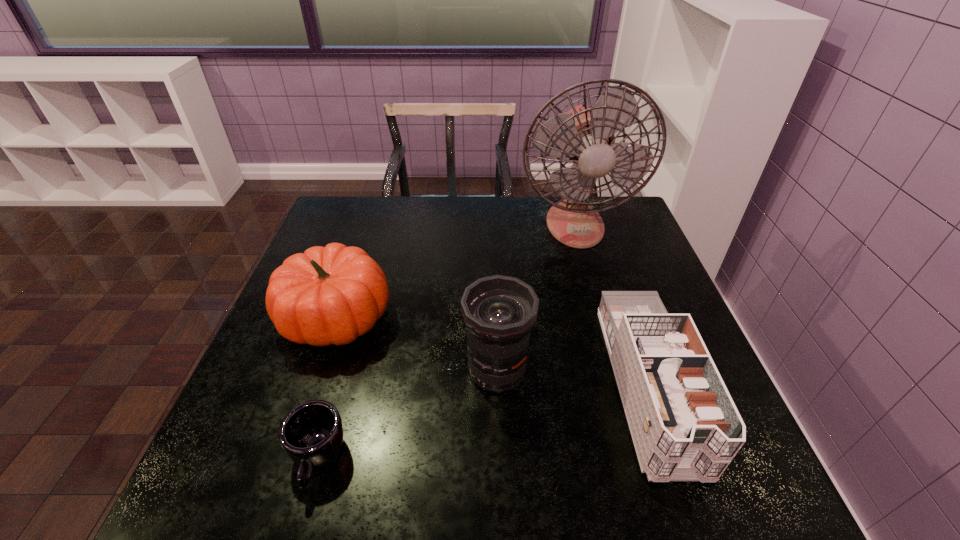
Identify the location of vacant space at the near edge of the desktop. (622, 469).

Locate an element on the screen. free region at the left edge of the desktop is located at coordinates (260, 395).

This screenshot has height=540, width=960. In order to click on free region at the right edge of the desktop in this screenshot , I will do `click(750, 457)`.

Where is `vacant space at the near left corner`? The height and width of the screenshot is (540, 960). vacant space at the near left corner is located at coordinates (222, 503).

Identify the location of vacant space at the far right corner. (611, 203).

Locate an element on the screen. This screenshot has height=540, width=960. free space between the fan and the shortest object is located at coordinates (446, 342).

This screenshot has width=960, height=540. What are the coordinates of `empty space between the shortest object and the second shortest object` in the screenshot? It's located at (482, 422).

You are a GUI agent. You are given a task and a screenshot of the screen. Output one action in this format:
    pyautogui.click(x=<x>, y=<y>)
    Task: Click on the free space that is in between the mug and the fan
    The width and height of the screenshot is (960, 540).
    Given the screenshot: What is the action you would take?
    pyautogui.click(x=446, y=342)

Find the location of `empty location between the telephoto lens and the second shortest object`. empty location between the telephoto lens and the second shortest object is located at coordinates (572, 377).

Where is `vacant region between the fan and the shortest object`? The height and width of the screenshot is (540, 960). vacant region between the fan and the shortest object is located at coordinates (446, 342).